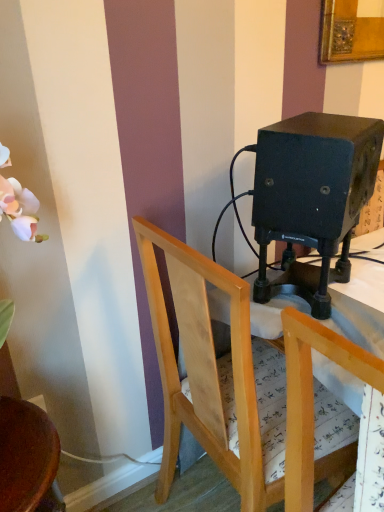
Question: From a real-world perspective, is light wood chair at center, the third chair from the left, above or below wooden chair at center, placed as the second chair when sorted from right to left?

Choices:
 (A) above
 (B) below

Answer: (A)

Question: From the image's perspective, is light wood chair at center, positioned as the first chair in right-to-left order, located above or below wooden chair at center, placed as the second chair when sorted from right to left?

Choices:
 (A) above
 (B) below

Answer: (B)

Question: Which object is the closest to the wooden chair at lower left, the first chair when ordered from left to right?

Choices:
 (A) light wood chair at center, positioned as the first chair in right-to-left order
 (B) wooden chair at center, which is the second chair from left to right

Answer: (B)

Question: Estimate the real-world distances between objects in this image. Which object is closer to the wooden chair at center, placed as the second chair when sorted from right to left?

Choices:
 (A) wooden chair at lower left, which is counted as the 3th chair, starting from the right
 (B) light wood chair at center, positioned as the first chair in right-to-left order

Answer: (B)